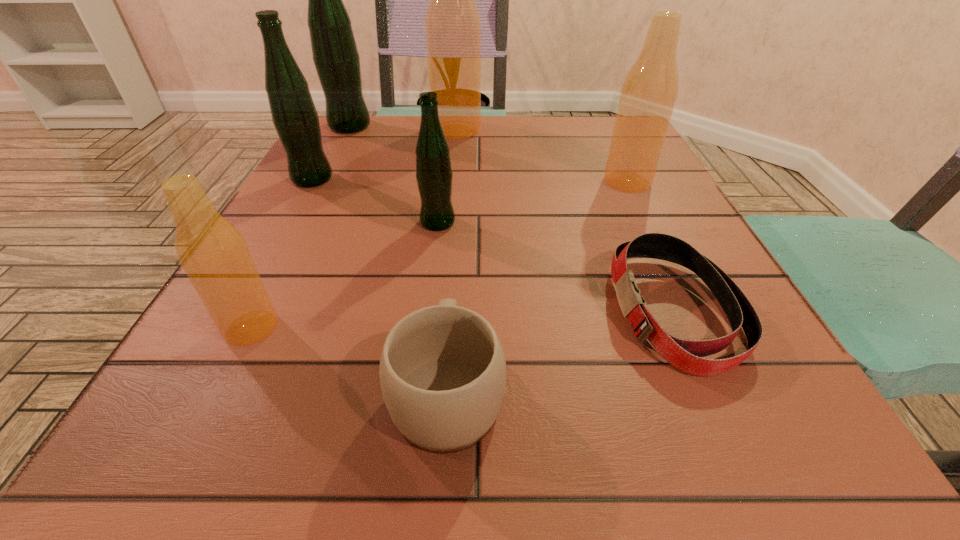
This screenshot has height=540, width=960. What are the coordinates of `blank space located 0.080m on the side of the second shortest object with the handle` in the screenshot? It's located at (453, 293).

Where is `blank space located 0.390m on the side of the second shortest object with the handle`? blank space located 0.390m on the side of the second shortest object with the handle is located at coordinates (461, 185).

At what (x,y) coordinates should I click in order to perform the action: click on free space located on the left of the pink dog collar. Please return your answer as a coordinate pair (x, y). The width and height of the screenshot is (960, 540). Looking at the image, I should click on (374, 312).

Find the location of a particular element. This screenshot has width=960, height=540. object at the near edge is located at coordinates (442, 371).

At what (x,y) coordinates should I click in order to perform the action: click on beer bottle that is at the right edge. Please return your answer as a coordinate pair (x, y). The width and height of the screenshot is (960, 540). Looking at the image, I should click on (649, 92).

At what (x,y) coordinates should I click in order to perform the action: click on dog collar that is positioned at the right edge. Please return your answer as a coordinate pair (x, y). Looking at the image, I should click on (685, 355).

At what (x,y) coordinates should I click in order to perform the action: click on object located in the far left corner section of the desktop. Please return your answer as a coordinate pair (x, y). This screenshot has height=540, width=960. Looking at the image, I should click on (335, 55).

You are a GUI agent. You are given a task and a screenshot of the screen. Output one action in this format:
    pyautogui.click(x=<x>, y=<y>)
    Task: Click on the vacant area at the far edge
    
    Given the screenshot: What is the action you would take?
    pyautogui.click(x=400, y=121)

In the image, there is a desktop. Where is `vacant space at the near edge`? Image resolution: width=960 pixels, height=540 pixels. vacant space at the near edge is located at coordinates click(593, 434).

This screenshot has width=960, height=540. Identify the location of free space at the left edge. (279, 354).